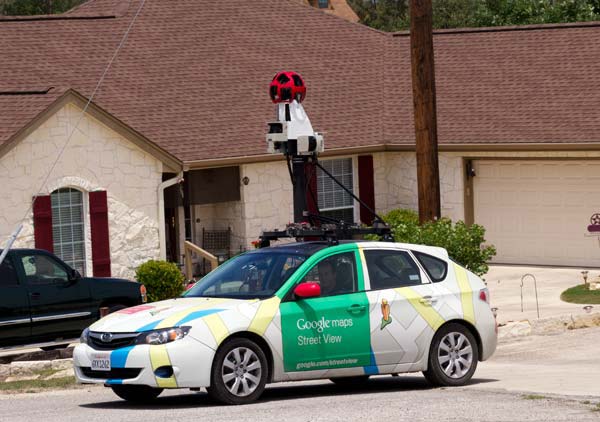
Image resolution: width=600 pixels, height=422 pixels. Find the location of `map sticker`. map sticker is located at coordinates (406, 339).